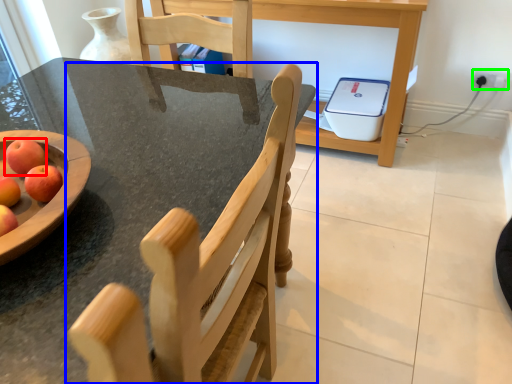
Question: Estimate the real-world distances between objects in this image. Which object is closer to apple (highlighted by a red box), chair (highlighted by a blue box) or electric outlet (highlighted by a green box)?

Choices:
 (A) chair
 (B) electric outlet

Answer: (A)